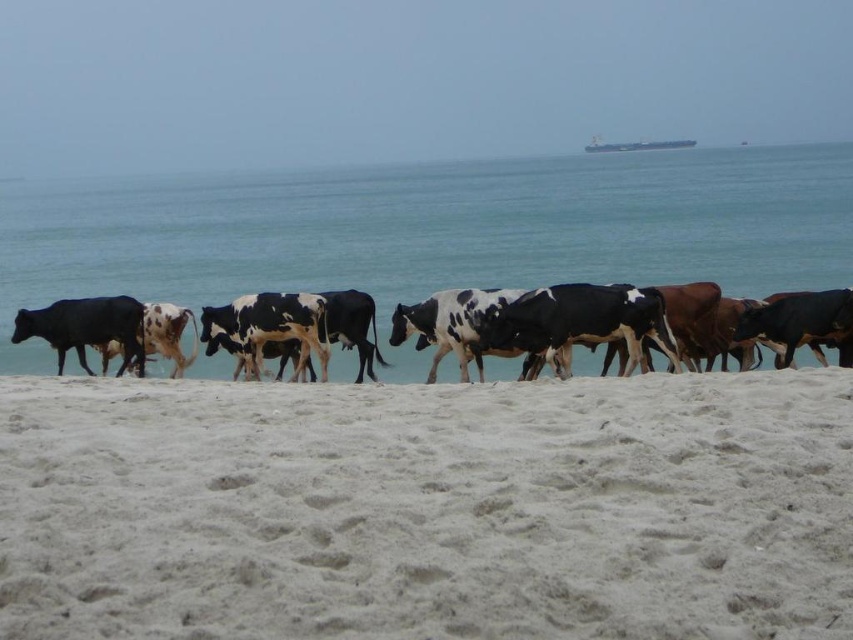
You are a photographer trying to capture the white sandy beach at lower center and the black glossy cow at left in a single frame. Based on the scene, which object takes up more area in the image?

The black glossy cow at left occupies more space in the image than the white sandy beach at lower center according to the description.

You are standing at the point with coordinates point (115,324) and want to walk to the point with coordinates point (602,461). Which direction should you face to walk towards your destination?

You should face towards the upper right direction because point (602,461) is in front of point (115,324), indicating it is located in the upper right relative to your starting position.

You are standing on the beach and see the blue water at center and the black glossy cow at left. Which object is closer to you based on their positions?

The black glossy cow at left is closer to you because the blue water at center is positioned over it, indicating it is farther away.